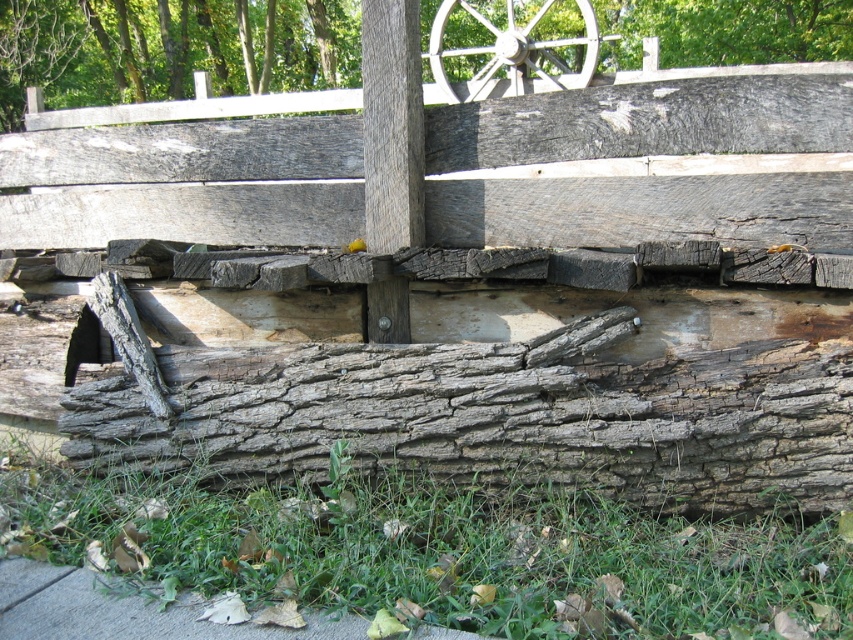
Can you confirm if weathered brown wood at lower center is shorter than white wooden wheel at upper center?

Correct, weathered brown wood at lower center is not as tall as white wooden wheel at upper center.

Who is more distant from viewer, (x=828, y=406) or (x=590, y=36)?

The point (x=590, y=36) is behind.

In order to click on weathered brown wood at lower center in this screenshot , I will do `click(496, 417)`.

Is point (67, 397) more distant than point (68, 22)?

No, it is in front of (68, 22).

Which is more to the left, weathered brown wood at lower center or smooth gray wood at upper center?

smooth gray wood at upper center

Does point (283, 448) come farther from viewer compared to point (843, 6)?

That is False.

At what (x,y) coordinates should I click in order to perform the action: click on weathered brown wood at lower center. Please return your answer as a coordinate pair (x, y). Looking at the image, I should click on (496, 417).

Between green rough grass at lower center and smooth gray wood at upper center, which one appears on the left side from the viewer's perspective?

Positioned to the left is smooth gray wood at upper center.

Based on the photo, is green rough grass at lower center further to camera compared to smooth gray wood at upper center?

No, green rough grass at lower center is in front of smooth gray wood at upper center.

Which is in front, point (556, 548) or point (704, 56)?

Point (556, 548)

The width and height of the screenshot is (853, 640). What are the coordinates of `green rough grass at lower center` in the screenshot? It's located at pyautogui.click(x=444, y=552).